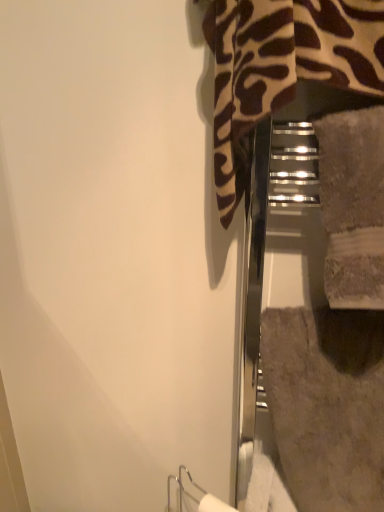
Question: From a real-world perspective, is gray textured bath towel at right above or below beige textured towel at center?

Choices:
 (A) above
 (B) below

Answer: (B)

Question: Is gray textured bath towel at right inside or outside of beige textured towel at center?

Choices:
 (A) outside
 (B) inside

Answer: (A)

Question: Is gray textured bath towel at right taller or shorter than beige textured towel at center?

Choices:
 (A) tall
 (B) short

Answer: (A)

Question: Looking at their shapes, would you say beige textured towel at center is wider or thinner than gray textured bath towel at right?

Choices:
 (A) wide
 (B) thin

Answer: (B)

Question: Is point (354, 291) closer or farther from the camera than point (329, 345)?

Choices:
 (A) closer
 (B) farther

Answer: (A)

Question: In terms of height, does beige textured towel at center look taller or shorter compared to gray textured bath towel at right?

Choices:
 (A) short
 (B) tall

Answer: (A)

Question: Based on their positions, is beige textured towel at center located to the left or right of gray textured bath towel at right?

Choices:
 (A) right
 (B) left

Answer: (B)